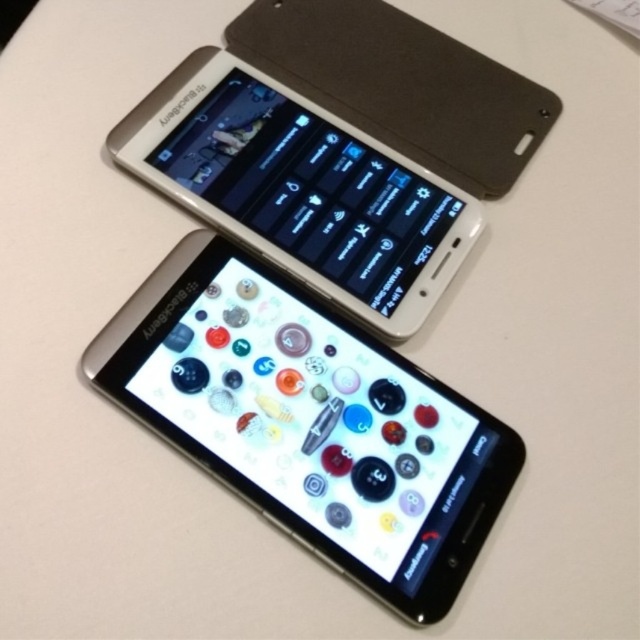
You are organizing a tech exhibition and need to arrange two smartphones on a display table. The satin silver phone at upper center and the matte black smartphone at upper center must be placed side by side. According to the scene, which phone should be positioned to the left to match the original arrangement?

The satin silver phone at upper center should be positioned to the left of the matte black smartphone at upper center to match the original arrangement.

You are a delivery person who needs to place a package between the silver metallic smartphone at center and the satin silver phone at upper center. The package is 9 inches long. Will it fit between them?

The silver metallic smartphone at center and the satin silver phone at upper center are 8.58 inches apart. Since the package is 9 inches long, it will not fit between them as the distance is shorter than the package length.

You are looking at two smartphones on a desk. There is a point at coordinates point (490, 451) and another at point (381, 120). Which point is closer to you?

Point (490, 451) is in front of point (381, 120), so it is closer to you.